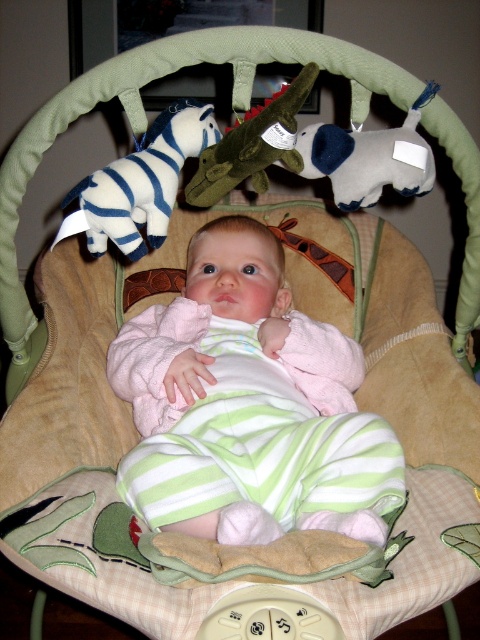
Question: Does pink fleece baby at center have a larger size compared to white plush zebra at upper left?

Choices:
 (A) no
 (B) yes

Answer: (B)

Question: Which point appears closest to the camera in this image?

Choices:
 (A) (105, 189)
 (B) (312, 156)
 (C) (156, 352)

Answer: (A)

Question: Estimate the real-world distances between objects in this image. Which object is closer to the pink fleece baby at center?

Choices:
 (A) velvety green plush crocodile at center
 (B) white plush zebra at upper left

Answer: (B)

Question: Considering the relative positions of white plush zebra at upper left and velvety green plush crocodile at center in the image provided, where is white plush zebra at upper left located with respect to velvety green plush crocodile at center?

Choices:
 (A) below
 (B) above

Answer: (A)

Question: Is the position of felt elephant at center more distant than that of velvety green plush crocodile at center?

Choices:
 (A) yes
 (B) no

Answer: (A)

Question: Which object is the farthest from the felt elephant at center?

Choices:
 (A) pink fleece baby at center
 (B) velvety green plush crocodile at center
 (C) white plush zebra at upper left

Answer: (A)